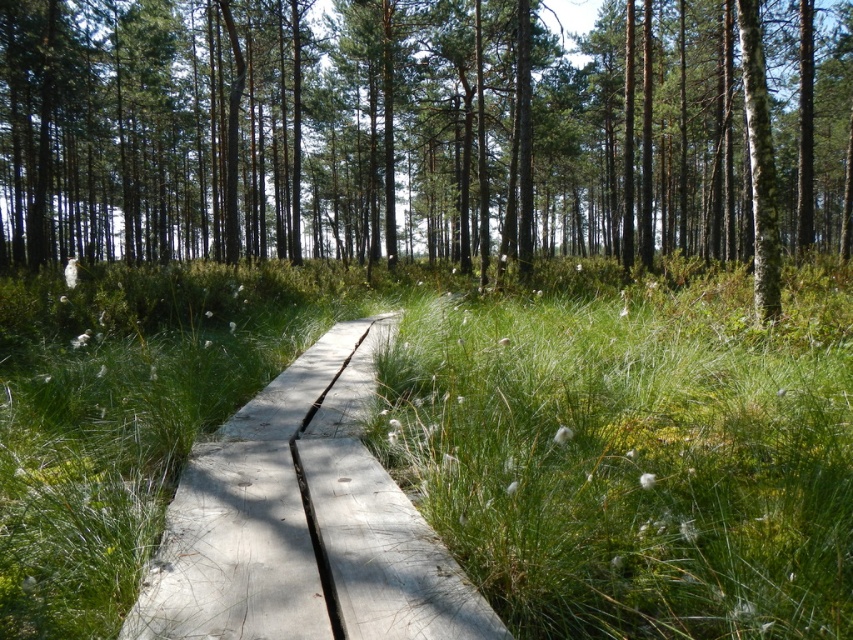
Question: In this image, where is brown wood tree at center located relative to light gray wooden path at center?

Choices:
 (A) left
 (B) right

Answer: (B)

Question: Which point is farther from the camera taking this photo?

Choices:
 (A) (401, 522)
 (B) (537, 541)

Answer: (A)

Question: Which point is farther from the camera taking this photo?

Choices:
 (A) (776, 76)
 (B) (259, 433)

Answer: (A)

Question: Which of the following is the farthest from the observer?

Choices:
 (A) (448, 136)
 (B) (650, 538)

Answer: (A)

Question: Does green grassy at center appear on the right side of brown wood tree at center?

Choices:
 (A) yes
 (B) no

Answer: (A)

Question: Can you confirm if green grassy at center is smaller than brown wood tree at center?

Choices:
 (A) no
 (B) yes

Answer: (B)